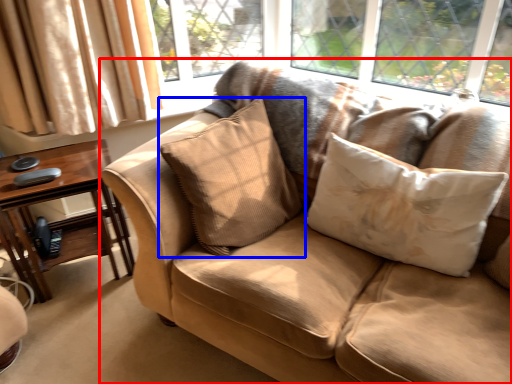
Question: Which object appears closest to the camera in this image, studio couch (highlighted by a red box) or pillow (highlighted by a blue box)?

Choices:
 (A) studio couch
 (B) pillow

Answer: (A)